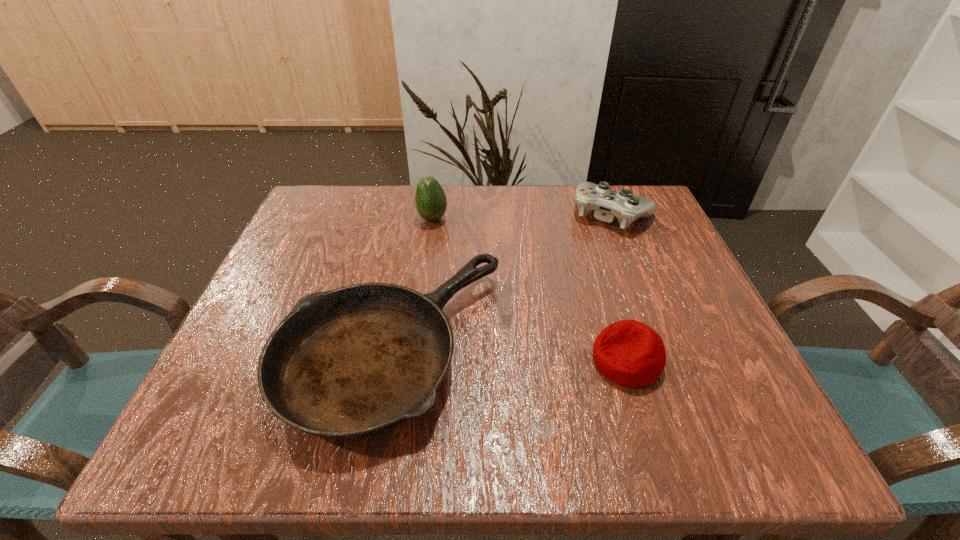
Where is `avocado positioned at the far edge`? This screenshot has height=540, width=960. avocado positioned at the far edge is located at coordinates (430, 199).

You are a GUI agent. You are given a task and a screenshot of the screen. Output one action in this format:
    pyautogui.click(x=<x>, y=<y>)
    Task: Click on the control at the far edge
    
    Given the screenshot: What is the action you would take?
    pyautogui.click(x=608, y=204)

This screenshot has width=960, height=540. I want to click on object situated at the near edge, so click(353, 362).

Where is `object that is at the left edge`? object that is at the left edge is located at coordinates (353, 362).

Where is `control that is at the right edge`? This screenshot has width=960, height=540. control that is at the right edge is located at coordinates (608, 204).

Where is `beanbag that is at the right edge`? beanbag that is at the right edge is located at coordinates [630, 353].

Locate an element on the screen. This screenshot has width=960, height=540. object that is positioned at the near left corner is located at coordinates (353, 362).

Locate an element on the screen. The height and width of the screenshot is (540, 960). object that is at the far right corner is located at coordinates (608, 204).

The width and height of the screenshot is (960, 540). I want to click on vacant space at the far edge, so click(x=513, y=194).

The height and width of the screenshot is (540, 960). What are the coordinates of `vacant space at the near edge of the desktop` in the screenshot? It's located at (598, 448).